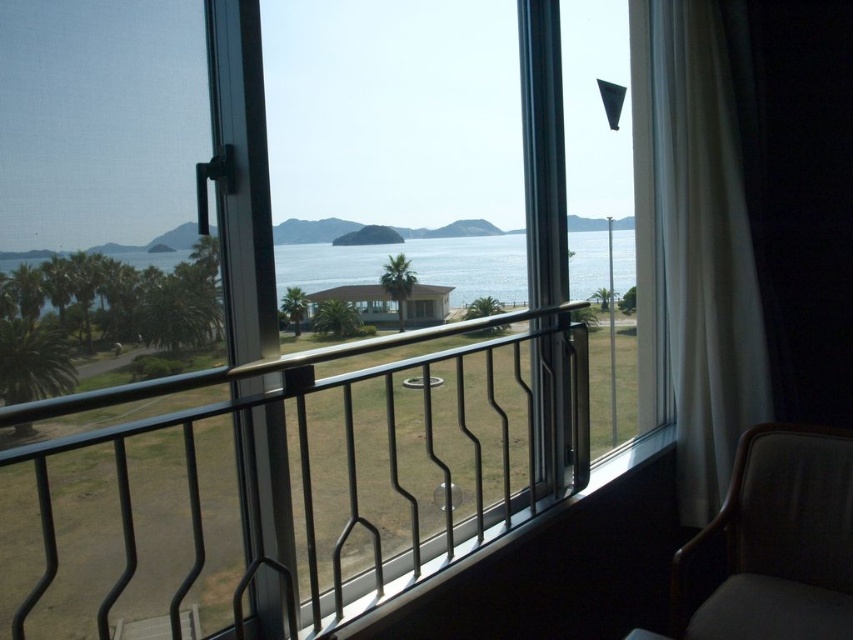
Is clear glass screen door at left below white sheer curtain at right?

Yes.

Between clear glass screen door at left and white sheer curtain at right, which one appears on the right side from the viewer's perspective?

Positioned to the right is white sheer curtain at right.

Is point (47, 113) closer to camera compared to point (747, 416)?

That is True.

At what (x,y) coordinates should I click in order to perform the action: click on clear glass screen door at left. Please return your answer as a coordinate pair (x, y). The height and width of the screenshot is (640, 853). Looking at the image, I should click on (143, 216).

Is clear glass screen door at left taller than dark brown fabric armchair at lower right?

Yes.

Is point (119, 458) in front of point (680, 595)?

Yes, point (119, 458) is in front of point (680, 595).

Find the location of a particular element. clear glass screen door at left is located at coordinates (143, 216).

Is clear glass screen door at left wider than black metal railing at center?

No, clear glass screen door at left is not wider than black metal railing at center.

From the picture: Who is positioned more to the right, clear glass screen door at left or black metal railing at center?

black metal railing at center

Is point (122, 504) positioned behind point (265, 560)?

That is False.

Where is `clear glass screen door at left`? The image size is (853, 640). clear glass screen door at left is located at coordinates (143, 216).